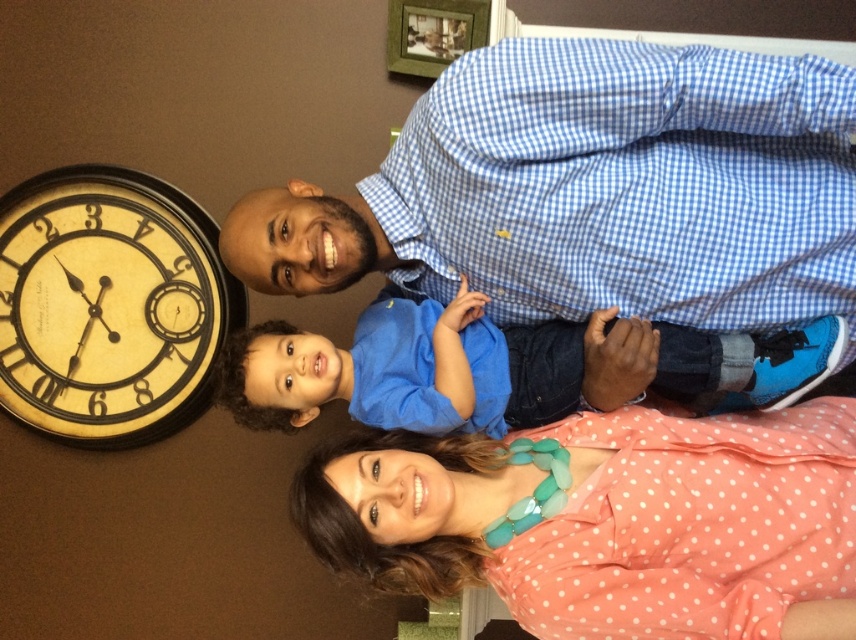
You are organizing a photo album and notice two items in the image that are important to include in the description. The items are the pink polka dot blouse at lower center and the yellow painted wood clock at left. Which of these two items is larger in size?

The pink polka dot blouse at lower center is larger than the yellow painted wood clock at left.

You are standing in the room and see two points marked in the image. The first point is at coordinates point(473, 179) and the second point is at point(248, 356). Which point is closer to you?

Point(473, 179) is in front of point(248, 356), so the first point is closer to you.